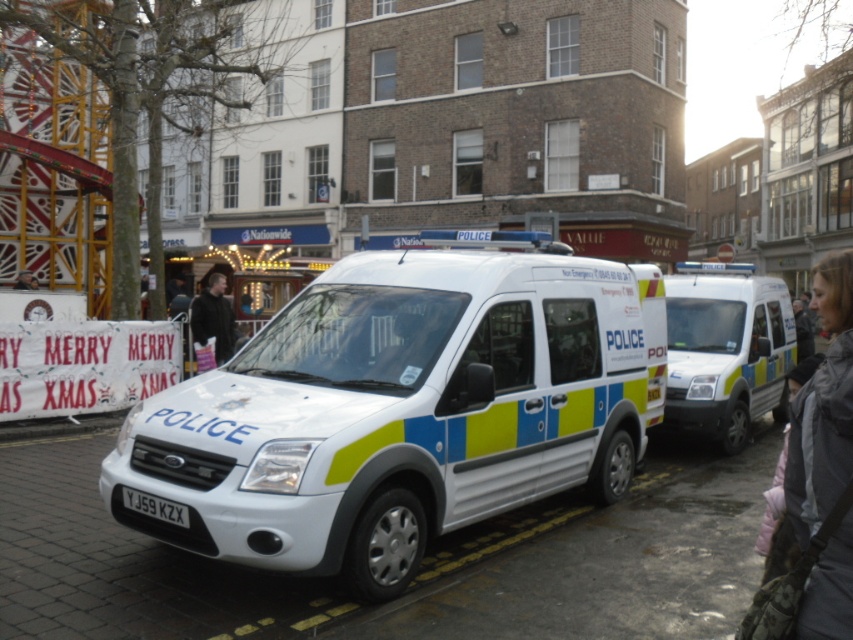
Does white glossy police van at center come in front of white glossy van at center?

Yes.

The height and width of the screenshot is (640, 853). Describe the element at coordinates (395, 410) in the screenshot. I see `white glossy police van at center` at that location.

What do you see at coordinates (395, 410) in the screenshot?
I see `white glossy police van at center` at bounding box center [395, 410].

At what (x,y) coordinates should I click in order to perform the action: click on white glossy police van at center. Please return your answer as a coordinate pair (x, y). Looking at the image, I should click on (395, 410).

Is gray fabric jacket at right to the right of black leather jacket at center from the viewer's perspective?

Yes, gray fabric jacket at right is to the right of black leather jacket at center.

Does gray fabric jacket at right appear over black leather jacket at center?

Yes, gray fabric jacket at right is above black leather jacket at center.

Which is behind, point (824, 260) or point (215, 323)?

The point (824, 260) is behind.

The height and width of the screenshot is (640, 853). In order to click on gray fabric jacket at right in this screenshot , I will do `click(822, 410)`.

Looking at this image, can you confirm if white glossy police van at center is positioned to the left of black leather jacket at center?

No, white glossy police van at center is not to the left of black leather jacket at center.

Can you confirm if white glossy police van at center is wider than black leather jacket at center?

No.

At what (x,y) coordinates should I click in order to perform the action: click on white glossy police van at center. Please return your answer as a coordinate pair (x, y). Looking at the image, I should click on (395, 410).